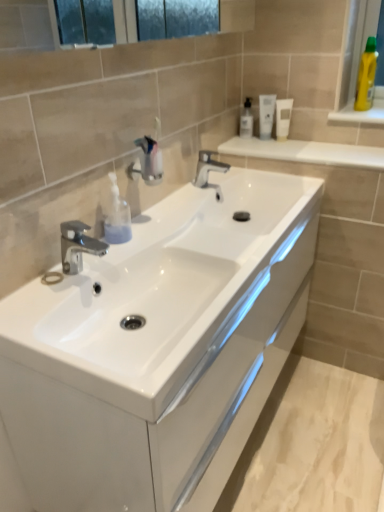
Question: Is there a large distance between white matte tube at upper center, the third mouthwash positioned from the left, and white glossy tube at upper right, which ranks as the 2th mouthwash in right-to-left order?

Choices:
 (A) yes
 (B) no

Answer: (B)

Question: Is white matte tube at upper center, the third mouthwash positioned from the left, completely or partially outside of white glossy tube at upper right, which ranks as the 2th mouthwash in right-to-left order?

Choices:
 (A) yes
 (B) no

Answer: (A)

Question: From the image's perspective, is white matte tube at upper center, placed as the 1th mouthwash when sorted from right to left, located above white glossy tube at upper right, which ranks as the 2th mouthwash in right-to-left order?

Choices:
 (A) yes
 (B) no

Answer: (B)

Question: Is the depth of white matte tube at upper center, the third mouthwash positioned from the left, greater than that of white glossy tube at upper right, which is the 2th mouthwash from left to right?

Choices:
 (A) no
 (B) yes

Answer: (A)

Question: Is white glossy tube at upper right, which ranks as the 2th mouthwash in right-to-left order, surrounded by white matte tube at upper center, the third mouthwash positioned from the left?

Choices:
 (A) yes
 (B) no

Answer: (B)

Question: From a real-world perspective, relative to polished chrome tap at center, acting as the 1th tap starting from the right, is white glossy tube at upper right, which ranks as the 2th mouthwash in right-to-left order, vertically above or below?

Choices:
 (A) below
 (B) above

Answer: (B)

Question: From the image's perspective, is white glossy tube at upper right, which ranks as the 2th mouthwash in right-to-left order, located above or below polished chrome tap at center, which is the second tap from left to right?

Choices:
 (A) below
 (B) above

Answer: (B)

Question: Considering the positions of white glossy tube at upper right, which is the 2th mouthwash from left to right, and polished chrome tap at center, the second tap from the bottom, in the image, is white glossy tube at upper right, which is the 2th mouthwash from left to right, taller or shorter than polished chrome tap at center, the second tap from the bottom,?

Choices:
 (A) short
 (B) tall

Answer: (B)

Question: Is point (268, 136) closer or farther from the camera than point (208, 185)?

Choices:
 (A) closer
 (B) farther

Answer: (B)

Question: Considering the positions of polished chrome tap at left, which is the first tap in left-to-right order, and clear plastic mouthwash at upper center, which is counted as the third mouthwash, starting from the right, in the image, is polished chrome tap at left, which is the first tap in left-to-right order, bigger or smaller than clear plastic mouthwash at upper center, which is counted as the third mouthwash, starting from the right,?

Choices:
 (A) small
 (B) big

Answer: (B)

Question: From a real-world perspective, is polished chrome tap at left, which is the first tap in left-to-right order, positioned above or below clear plastic mouthwash at upper center, which appears as the first mouthwash when viewed from the left?

Choices:
 (A) below
 (B) above

Answer: (A)

Question: Considering their positions, is polished chrome tap at left, arranged as the 2th tap when viewed from the top, located in front of or behind clear plastic mouthwash at upper center, which is counted as the third mouthwash, starting from the right?

Choices:
 (A) front
 (B) behind

Answer: (A)

Question: In terms of width, does polished chrome tap at left, positioned as the first tap in front-to-back order, look wider or thinner when compared to clear plastic mouthwash at upper center, which is counted as the third mouthwash, starting from the right?

Choices:
 (A) thin
 (B) wide

Answer: (B)

Question: Based on their positions, is metallic chrome faucet at center located to the left or right of polished chrome tap at left, which is counted as the 2th tap, starting from the back?

Choices:
 (A) left
 (B) right

Answer: (B)

Question: Looking at their shapes, would you say metallic chrome faucet at center is wider or thinner than polished chrome tap at left, which is the first tap in left-to-right order?

Choices:
 (A) wide
 (B) thin

Answer: (B)